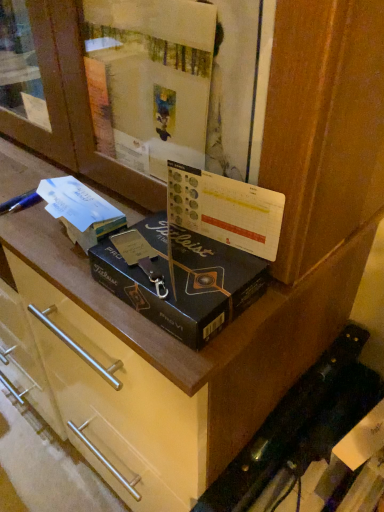
Locate an element on the screen. The height and width of the screenshot is (512, 384). white paper at upper left is located at coordinates (80, 210).

In order to face white paper at upper left, should I rotate leftwards or rightwards?

A 14.929 degree turn to the left will do.

This screenshot has width=384, height=512. Describe the element at coordinates (80, 210) in the screenshot. I see `white paper at upper left` at that location.

What do you see at coordinates (183, 280) in the screenshot? I see `black matte box at center` at bounding box center [183, 280].

The width and height of the screenshot is (384, 512). In order to click on black matte box at center in this screenshot , I will do [183, 280].

What are the coordinates of `white paper at upper left` in the screenshot? It's located at (80, 210).

Does black matte box at center appear on the right side of white paper at upper left?

Yes, black matte box at center is to the right of white paper at upper left.

Which object is further away from the camera, black matte box at center or white paper at upper left?

Positioned behind is white paper at upper left.

Which is closer to the camera, (162, 311) or (87, 187)?

The point (162, 311) is closer.

From the image's perspective, is black matte box at center below white paper at upper left?

Yes, from the image's perspective, black matte box at center is beneath white paper at upper left.

From a real-world perspective, who is located lower, black matte box at center or white paper at upper left?

black matte box at center, from a real-world perspective.

Which object is wider, black matte box at center or white paper at upper left?

black matte box at center.

From their relative heights in the image, would you say black matte box at center is taller or shorter than white paper at upper left?

black matte box at center is shorter than white paper at upper left.

Is black matte box at center bigger than white paper at upper left?

Correct, black matte box at center is larger in size than white paper at upper left.

Is black matte box at center completely or partially outside of white paper at upper left?

Yes, black matte box at center is located beyond the bounds of white paper at upper left.

Is black matte box at center positioned far away from white paper at upper left?

No, black matte box at center is not far from white paper at upper left.

Could you tell me if black matte box at center is facing white paper at upper left?

No, black matte box at center is not oriented towards white paper at upper left.

How different are the orientations of black matte box at center and white paper at upper left in degrees?

6.86 degrees separate the facing orientations of black matte box at center and white paper at upper left.

How much distance is there between black matte box at center and white paper at upper left?

The distance of black matte box at center from white paper at upper left is 4.49 inches.

Find the location of a particular element. This screenshot has height=512, width=384. box that appears below the white paper at upper left (from the image's perspective) is located at coordinates (183, 280).

Can you confirm if white paper at upper left is positioned to the right of black matte box at center?

No.

Is white paper at upper left closer to camera compared to black matte box at center?

That is False.

Is point (75, 221) farther from camera compared to point (189, 323)?

Yes, it is behind point (189, 323).

From the image's perspective, which one is positioned higher, white paper at upper left or black matte box at center?

white paper at upper left appears higher in the image.

From a real-world perspective, is white paper at upper left located higher than black matte box at center?

Correct, in the physical world, white paper at upper left is higher than black matte box at center.

Considering the sizes of objects white paper at upper left and black matte box at center in the image provided, who is thinner, white paper at upper left or black matte box at center?

white paper at upper left.

Considering the relative sizes of white paper at upper left and black matte box at center in the image provided, is white paper at upper left shorter than black matte box at center?

Incorrect, the height of white paper at upper left does not fall short of that of black matte box at center.

Is white paper at upper left smaller than black matte box at center?

Yes.

Is white paper at upper left surrounding black matte box at center?

No, black matte box at center is not a part of white paper at upper left.

Is white paper at upper left not near black matte box at center?

No, white paper at upper left is in close proximity to black matte box at center.

Is white paper at upper left oriented away from black matte box at center?

No.

How many degrees apart are the facing directions of white paper at upper left and black matte box at center?

The angular difference between white paper at upper left and black matte box at center is 6.86 degrees.

How distant is white paper at upper left from black matte box at center?

4.49 inches.

This screenshot has width=384, height=512. Identify the location of book on the left of black matte box at center. (80, 210).

Identify the location of box that appears on the right of white paper at upper left. This screenshot has height=512, width=384. (183, 280).

I want to click on book above the black matte box at center (from the image's perspective), so click(80, 210).